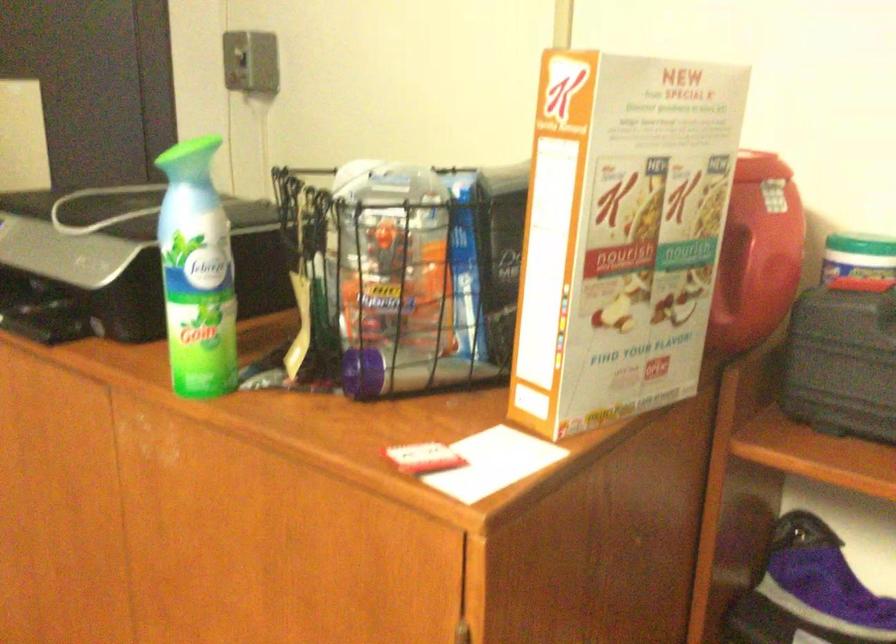
At what (x,y) coordinates should I click in order to perform the action: click on light switch. Please return your answer as a coordinate pair (x, y). Looking at the image, I should click on (239, 57).